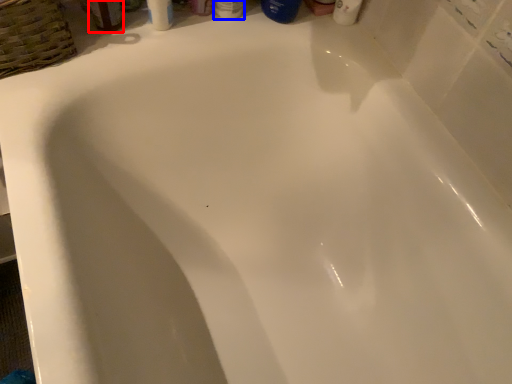
Question: Among these objects, which one is nearest to the camera, mouthwash (highlighted by a red box) or toiletry (highlighted by a blue box)?

Choices:
 (A) mouthwash
 (B) toiletry

Answer: (A)